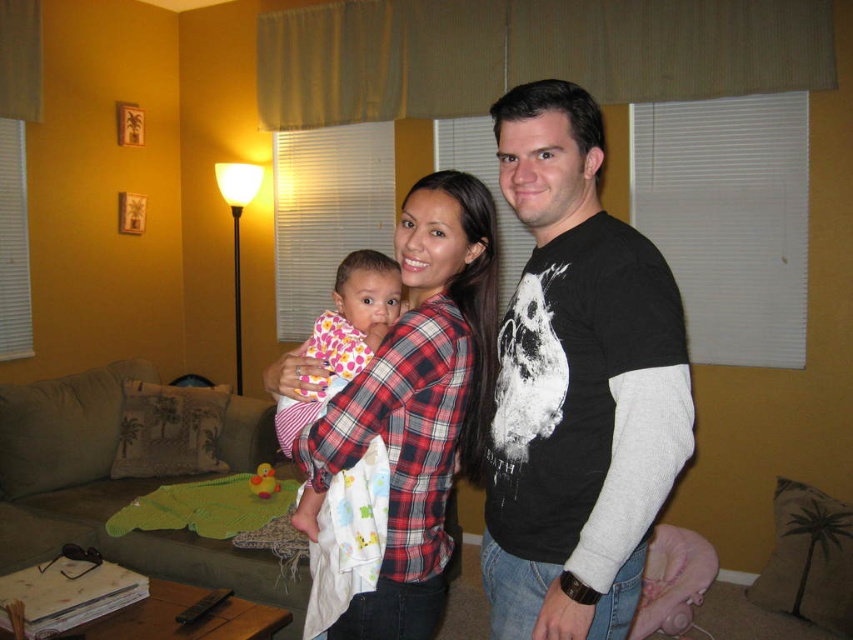
Question: Does black matte t-shirt at center have a lesser width compared to polka dot fabric baby at center?

Choices:
 (A) no
 (B) yes

Answer: (A)

Question: Among these objects, which one is nearest to the camera?

Choices:
 (A) plaid shirt at center
 (B) polka dot fabric baby at center

Answer: (A)

Question: Observing the image, what is the correct spatial positioning of black matte t-shirt at center in reference to polka dot fabric baby at center?

Choices:
 (A) below
 (B) above

Answer: (B)

Question: Among these points, which one is farthest from the camera?

Choices:
 (A) (573, 394)
 (B) (343, 376)

Answer: (B)

Question: Where is black matte t-shirt at center located in relation to plaid shirt at center in the image?

Choices:
 (A) right
 (B) left

Answer: (A)

Question: Estimate the real-world distances between objects in this image. Which object is farther from the polka dot fabric baby at center?

Choices:
 (A) black matte t-shirt at center
 (B) plaid shirt at center

Answer: (A)